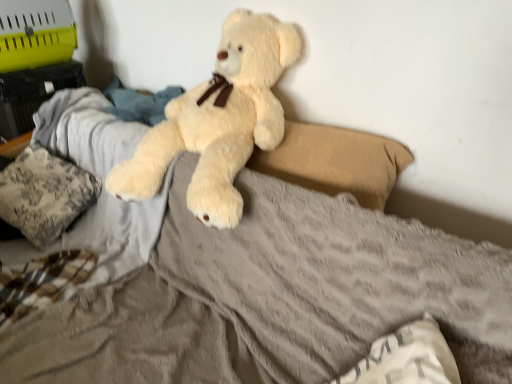
Question: Is fluffy fabric pillow at left, acting as the 1th pillow starting from the back, wider than beige fabric pillow at center, the second pillow in the front-to-back sequence?

Choices:
 (A) no
 (B) yes

Answer: (B)

Question: Is beige fabric pillow at center, the 2th pillow in the left-to-right sequence, at the back of fluffy fabric pillow at left, which ranks as the first pillow in left-to-right order?

Choices:
 (A) no
 (B) yes

Answer: (A)

Question: From a real-world perspective, is fluffy fabric pillow at left, which appears as the 3th pillow when viewed from the right, on beige fabric pillow at center, the 2th pillow in the left-to-right sequence?

Choices:
 (A) yes
 (B) no

Answer: (B)

Question: Does fluffy fabric pillow at left, which appears as the 3th pillow when viewed from the right, have a smaller size compared to beige fabric pillow at center, which appears as the second pillow when viewed from the right?

Choices:
 (A) no
 (B) yes

Answer: (A)

Question: Is fluffy fabric pillow at left, acting as the 1th pillow starting from the back, aimed at beige fabric pillow at center, the second pillow in the front-to-back sequence?

Choices:
 (A) no
 (B) yes

Answer: (A)

Question: Is fluffy fabric pillow at left, which appears as the 3th pillow when viewed from the right, in contact with beige fabric pillow at center, the 2th pillow in the left-to-right sequence?

Choices:
 (A) yes
 (B) no

Answer: (B)

Question: Can you confirm if beige fabric pillow at center, the 2th pillow in the left-to-right sequence, is bigger than white soft pillow at lower right, which is the 1th pillow in right-to-left order?

Choices:
 (A) yes
 (B) no

Answer: (A)

Question: Considering the relative sizes of beige fabric pillow at center, the 2th pillow in the left-to-right sequence, and white soft pillow at lower right, which is the 1th pillow from front to back, in the image provided, is beige fabric pillow at center, the 2th pillow in the left-to-right sequence, smaller than white soft pillow at lower right, which is the 1th pillow from front to back,?

Choices:
 (A) yes
 (B) no

Answer: (B)

Question: From a real-world perspective, is beige fabric pillow at center, which appears as the second pillow when viewed from the right, physically above white soft pillow at lower right, which is the 1th pillow in right-to-left order?

Choices:
 (A) no
 (B) yes

Answer: (B)

Question: Can you confirm if beige fabric pillow at center, which appears as the second pillow when viewed from the right, is thinner than white soft pillow at lower right, which is the 1th pillow in right-to-left order?

Choices:
 (A) yes
 (B) no

Answer: (A)

Question: Is beige fabric pillow at center, the second pillow when ordered from back to front, at the right side of white soft pillow at lower right, which is the 1th pillow from front to back?

Choices:
 (A) no
 (B) yes

Answer: (A)

Question: From a real-world perspective, is beige fabric pillow at center, which appears as the second pillow when viewed from the right, under white soft pillow at lower right, the 3th pillow when ordered from back to front?

Choices:
 (A) yes
 (B) no

Answer: (B)

Question: Can you confirm if white soft pillow at lower right, the 3th pillow when ordered from back to front, is shorter than beige fabric pillow at center, the second pillow when ordered from back to front?

Choices:
 (A) yes
 (B) no

Answer: (A)